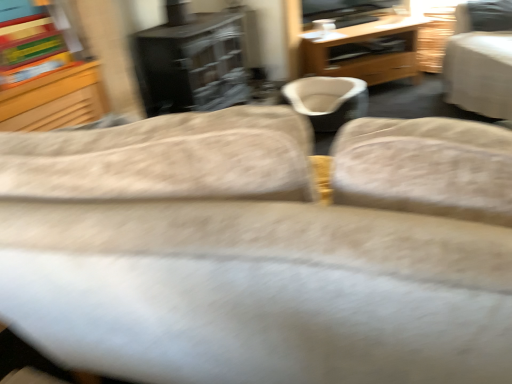
Question: From a real-world perspective, is wooden desk at center positioned under light gray fabric chair at upper right based on gravity?

Choices:
 (A) no
 (B) yes

Answer: (B)

Question: Is wooden desk at center looking in the opposite direction of light gray fabric chair at upper right?

Choices:
 (A) no
 (B) yes

Answer: (A)

Question: Can you confirm if wooden desk at center is positioned to the right of light gray fabric chair at upper right?

Choices:
 (A) yes
 (B) no

Answer: (B)

Question: Is wooden desk at center in front of light gray fabric chair at upper right?

Choices:
 (A) yes
 (B) no

Answer: (B)

Question: Can you confirm if wooden desk at center is bigger than light gray fabric chair at upper right?

Choices:
 (A) yes
 (B) no

Answer: (B)

Question: Would you say wooden desk at center is a long distance from light gray fabric chair at upper right?

Choices:
 (A) yes
 (B) no

Answer: (B)

Question: Is light gray fabric chair at upper right not inside beige fabric bean bag chair at center?

Choices:
 (A) no
 (B) yes

Answer: (B)

Question: Can you confirm if light gray fabric chair at upper right is smaller than beige fabric bean bag chair at center?

Choices:
 (A) no
 (B) yes

Answer: (A)

Question: Is light gray fabric chair at upper right at the left side of beige fabric bean bag chair at center?

Choices:
 (A) no
 (B) yes

Answer: (A)

Question: From a real-world perspective, is light gray fabric chair at upper right beneath beige fabric bean bag chair at center?

Choices:
 (A) no
 (B) yes

Answer: (A)

Question: From the image's perspective, is light gray fabric chair at upper right over beige fabric bean bag chair at center?

Choices:
 (A) no
 (B) yes

Answer: (B)

Question: Are light gray fabric chair at upper right and beige fabric bean bag chair at center located far from each other?

Choices:
 (A) yes
 (B) no

Answer: (B)

Question: Does light gray fabric chair at upper right appear on the right side of wooden desk at center?

Choices:
 (A) no
 (B) yes

Answer: (B)